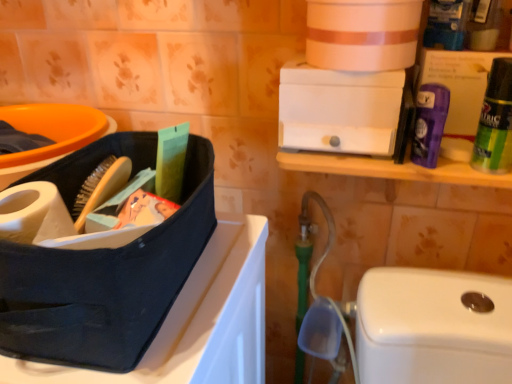
At what (x,y) coordinates should I click in order to perform the action: click on white plastic drawer at upper center. Please return your answer as a coordinate pair (x, y). The width and height of the screenshot is (512, 384). Looking at the image, I should click on (392, 169).

What do you see at coordinates (495, 122) in the screenshot? This screenshot has height=384, width=512. I see `green matte fabric softener at upper right, the 2th cleaning product positioned from the left` at bounding box center [495, 122].

The height and width of the screenshot is (384, 512). What are the coordinates of `white plastic drawer at upper center` in the screenshot? It's located at (392, 169).

Could you tell me if green matte fabric softener at upper right, positioned as the first cleaning product in right-to-left order, is facing purple matte deodorant at upper right?

No, green matte fabric softener at upper right, positioned as the first cleaning product in right-to-left order, is not oriented towards purple matte deodorant at upper right.

From a real-world perspective, who is located higher, green matte fabric softener at upper right, positioned as the first cleaning product in right-to-left order, or purple matte deodorant at upper right?

green matte fabric softener at upper right, positioned as the first cleaning product in right-to-left order, from a real-world perspective.

In the scene shown: Would you say green matte fabric softener at upper right, the 2th cleaning product positioned from the left, is outside purple matte deodorant at upper right?

green matte fabric softener at upper right, the 2th cleaning product positioned from the left, is positioned outside purple matte deodorant at upper right.

In the image, is green matte fabric softener at upper right, positioned as the first cleaning product in right-to-left order, on the left side or the right side of purple matte deodorant at upper right?

In the image, green matte fabric softener at upper right, positioned as the first cleaning product in right-to-left order, appears on the right side of purple matte deodorant at upper right.

The image size is (512, 384). In the image, there is a green matte fabric softener at upper right, the 2th cleaning product positioned from the left. In order to click on cleaning product below it (from the image's perspective) in this screenshot , I will do `click(429, 123)`.

From a real-world perspective, which is physically below, purple matte deodorant at upper right, which is the 1th cleaning product from left to right, or green matte fabric softener at upper right, positioned as the first cleaning product in right-to-left order?

purple matte deodorant at upper right, which is the 1th cleaning product from left to right, from a real-world perspective.

Which is behind, point (421, 85) or point (496, 92)?

The point (421, 85) is behind.

Who is bigger, purple matte deodorant at upper right, positioned as the 2th cleaning product in right-to-left order, or green matte fabric softener at upper right, the 2th cleaning product positioned from the left?

With larger size is green matte fabric softener at upper right, the 2th cleaning product positioned from the left.

Is green matte fabric softener at upper right, the 2th cleaning product positioned from the left, wider or thinner than matte black lunch box at left?

Considering their sizes, green matte fabric softener at upper right, the 2th cleaning product positioned from the left, looks slimmer than matte black lunch box at left.

Between green matte fabric softener at upper right, the 2th cleaning product positioned from the left, and matte black lunch box at left, which one is positioned in front?

matte black lunch box at left.

How different are the orientations of green matte fabric softener at upper right, positioned as the first cleaning product in right-to-left order, and matte black lunch box at left in degrees?

2.47 degrees.

Which is correct: purple matte deodorant at upper right, which is the 1th cleaning product from left to right, is inside white plastic drawer at upper center, or outside of it?

purple matte deodorant at upper right, which is the 1th cleaning product from left to right, is located beyond the bounds of white plastic drawer at upper center.

Is purple matte deodorant at upper right, positioned as the 2th cleaning product in right-to-left order, taller than white plastic drawer at upper center?

No.

In the scene shown: From the image's perspective, is purple matte deodorant at upper right, which is the 1th cleaning product from left to right, beneath white plastic drawer at upper center?

Correct, purple matte deodorant at upper right, which is the 1th cleaning product from left to right, appears lower than white plastic drawer at upper center in the image.

This screenshot has height=384, width=512. I want to click on cleaning product that is the 1st one when counting rightward from the matte black lunch box at left, so click(429, 123).

Is matte black lunch box at left wider or thinner than purple matte deodorant at upper right, which is the 1th cleaning product from left to right?

matte black lunch box at left is wider than purple matte deodorant at upper right, which is the 1th cleaning product from left to right.

From a real-world perspective, is matte black lunch box at left physically located above or below purple matte deodorant at upper right, which is the 1th cleaning product from left to right?

matte black lunch box at left is situated lower than purple matte deodorant at upper right, which is the 1th cleaning product from left to right, in the real world.

Based on the photo, from the image's perspective, relative to purple matte deodorant at upper right, which is the 1th cleaning product from left to right, is matte black lunch box at left above or below?

From the image's perspective, matte black lunch box at left appears below purple matte deodorant at upper right, which is the 1th cleaning product from left to right.

Considering the positions of objects white plastic drawer at upper center and purple matte deodorant at upper right, which is the 1th cleaning product from left to right, in the image provided, who is more to the left, white plastic drawer at upper center or purple matte deodorant at upper right, which is the 1th cleaning product from left to right,?

From the viewer's perspective, white plastic drawer at upper center appears more on the left side.

Between white plastic drawer at upper center and purple matte deodorant at upper right, positioned as the 2th cleaning product in right-to-left order, which one has more height?

With more height is white plastic drawer at upper center.

Considering the sizes of objects white plastic drawer at upper center and purple matte deodorant at upper right, positioned as the 2th cleaning product in right-to-left order, in the image provided, who is bigger, white plastic drawer at upper center or purple matte deodorant at upper right, positioned as the 2th cleaning product in right-to-left order,?

Bigger between the two is white plastic drawer at upper center.

What's the angular difference between matte black lunch box at left and green matte fabric softener at upper right, the 2th cleaning product positioned from the left,'s facing directions?

matte black lunch box at left and green matte fabric softener at upper right, the 2th cleaning product positioned from the left, are facing 2.47 degrees away from each other.

In the scene shown: Is matte black lunch box at left next to green matte fabric softener at upper right, positioned as the first cleaning product in right-to-left order, and touching it?

No, matte black lunch box at left is not beside green matte fabric softener at upper right, positioned as the first cleaning product in right-to-left order.

Considering the relative sizes of matte black lunch box at left and green matte fabric softener at upper right, positioned as the first cleaning product in right-to-left order, in the image provided, is matte black lunch box at left taller than green matte fabric softener at upper right, positioned as the first cleaning product in right-to-left order,?

Correct, matte black lunch box at left is much taller as green matte fabric softener at upper right, positioned as the first cleaning product in right-to-left order.

From a real-world perspective, who is located higher, matte black lunch box at left or green matte fabric softener at upper right, the 2th cleaning product positioned from the left?

From a 3D spatial view, green matte fabric softener at upper right, the 2th cleaning product positioned from the left, is above.

The image size is (512, 384). I want to click on storage box to the left of green matte fabric softener at upper right, the 2th cleaning product positioned from the left, so click(x=458, y=94).

Find the location of a particular element. Image resolution: width=512 pixels, height=384 pixels. cleaning product that appears in front of the purple matte deodorant at upper right, which is the 1th cleaning product from left to right is located at coordinates (495, 122).

When comparing their distances from white plastic drawer at upper center, does purple matte deodorant at upper right, which is the 1th cleaning product from left to right, or green matte fabric softener at upper right, the 2th cleaning product positioned from the left, seem closer?

Among the two, purple matte deodorant at upper right, which is the 1th cleaning product from left to right, is located nearer to white plastic drawer at upper center.

Based on their spatial positions, is green matte fabric softener at upper right, positioned as the first cleaning product in right-to-left order, or white plastic drawer at upper center further from purple matte deodorant at upper right?

The object further to purple matte deodorant at upper right is green matte fabric softener at upper right, positioned as the first cleaning product in right-to-left order.

Consider the image. Estimate the real-world distances between objects in this image. Which object is further from purple matte deodorant at upper right, matte black lunch box at left or purple matte deodorant at upper right, which is the 1th cleaning product from left to right?

matte black lunch box at left is further to purple matte deodorant at upper right.

Looking at the image, which one is located closer to purple matte deodorant at upper right, white plastic drawer at upper center or green matte fabric softener at upper right, the 2th cleaning product positioned from the left?

white plastic drawer at upper center lies closer to purple matte deodorant at upper right than the other object.

Considering their positions, is matte black lunch box at left positioned closer to white plastic drawer at upper center than purple matte deodorant at upper right?

purple matte deodorant at upper right is positioned closer to the anchor white plastic drawer at upper center.

Considering their positions, is white plastic drawer at upper center positioned further to purple matte deodorant at upper right than matte black lunch box at left?

Based on the image, matte black lunch box at left appears to be further to purple matte deodorant at upper right.

Based on their spatial positions, is purple matte deodorant at upper right or purple matte deodorant at upper right, which is the 1th cleaning product from left to right, further from matte black lunch box at left?

Among the two, purple matte deodorant at upper right is located further to matte black lunch box at left.

Based on their spatial positions, is purple matte deodorant at upper right or white plastic drawer at upper center closer to matte black lunch box at left?

Based on the image, white plastic drawer at upper center appears to be nearer to matte black lunch box at left.

Where is `storage box between purple matte deodorant at upper right, which is the 1th cleaning product from left to right, and green matte fabric softener at upper right, positioned as the first cleaning product in right-to-left order, in the horizontal direction`? The image size is (512, 384). storage box between purple matte deodorant at upper right, which is the 1th cleaning product from left to right, and green matte fabric softener at upper right, positioned as the first cleaning product in right-to-left order, in the horizontal direction is located at coordinates (458, 94).

You are a GUI agent. You are given a task and a screenshot of the screen. Output one action in this format:
    pyautogui.click(x=<x>, y=<y>)
    Task: Click on the cleaning product between white plastic drawer at upper center and green matte fabric softener at upper right, positioned as the first cleaning product in right-to-left order, in the horizontal direction
    Image resolution: width=512 pixels, height=384 pixels.
    Given the screenshot: What is the action you would take?
    pyautogui.click(x=429, y=123)

Where is `shelf located between matte black lunch box at left and purple matte deodorant at upper right in the left-right direction`? shelf located between matte black lunch box at left and purple matte deodorant at upper right in the left-right direction is located at coordinates (392, 169).

Where is `storage box between matte black lunch box at left and green matte fabric softener at upper right, positioned as the first cleaning product in right-to-left order, in the horizontal direction`? storage box between matte black lunch box at left and green matte fabric softener at upper right, positioned as the first cleaning product in right-to-left order, in the horizontal direction is located at coordinates (458, 94).